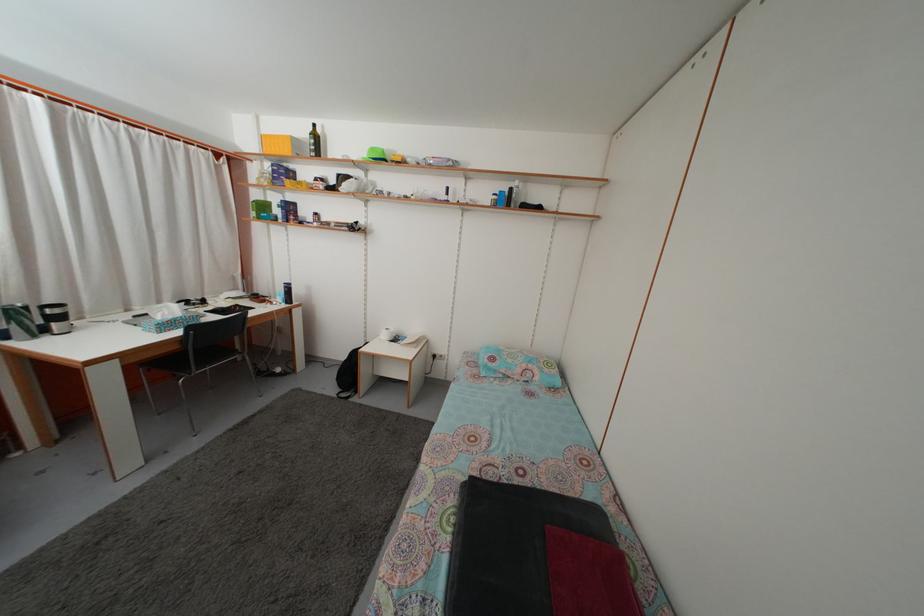
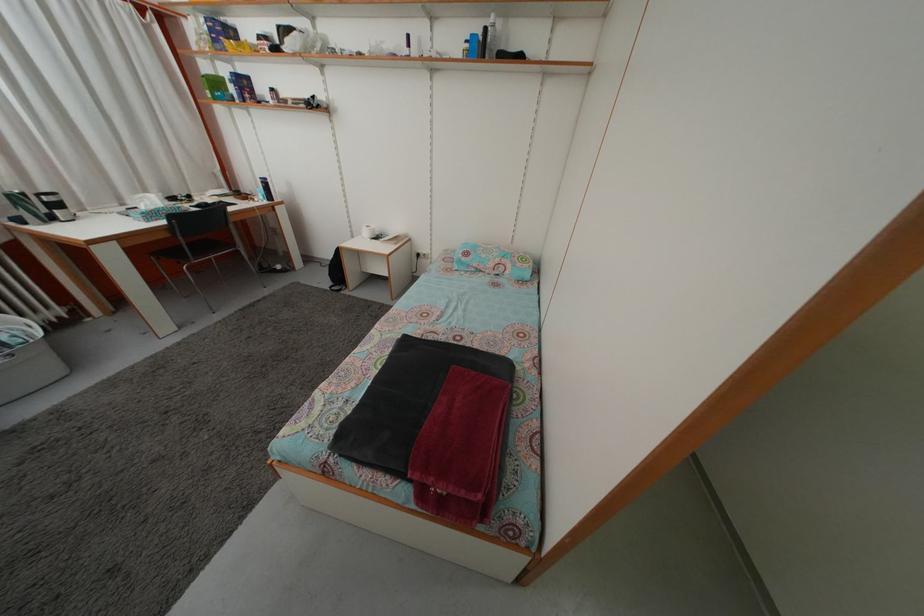
Where in the second image is the point corresponding to (x=517, y=197) from the first image?

(492, 38)